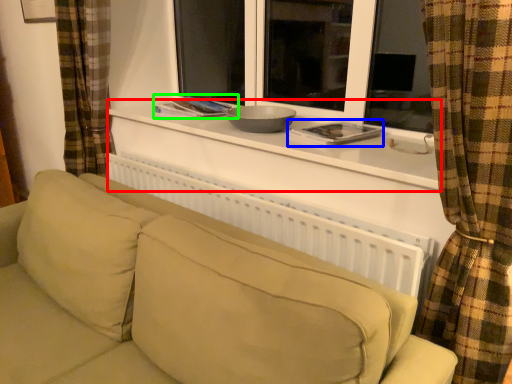
Question: Which is nearer to the window sill (highlighted by a red box)? book (highlighted by a blue box) or book (highlighted by a green box).

Choices:
 (A) book
 (B) book

Answer: (A)